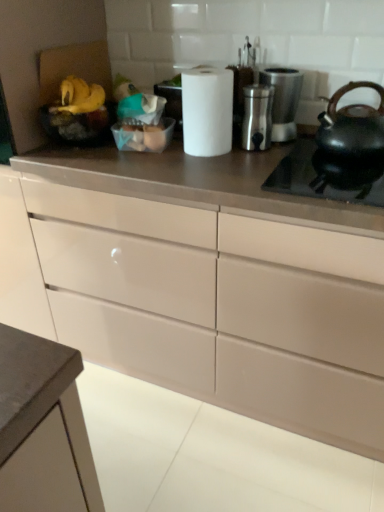
Question: Should I look upward or downward to see satin silver container at center, the 1th appliance from the left?

Choices:
 (A) up
 (B) down

Answer: (A)

Question: Does satin silver coffee maker at upper right, the 1th appliance from the right, have a smaller size compared to white matte paper towel at center?

Choices:
 (A) yes
 (B) no

Answer: (A)

Question: Does satin silver coffee maker at upper right, the 1th appliance from the right, have a larger size compared to white matte paper towel at center?

Choices:
 (A) yes
 (B) no

Answer: (B)

Question: Can white matte paper towel at center be found inside satin silver coffee maker at upper right, the 1th appliance from the right?

Choices:
 (A) yes
 (B) no

Answer: (B)

Question: Is satin silver coffee maker at upper right, which is counted as the 2th appliance, starting from the left, looking in the opposite direction of white matte paper towel at center?

Choices:
 (A) no
 (B) yes

Answer: (A)

Question: Can you confirm if satin silver coffee maker at upper right, which is counted as the 2th appliance, starting from the left, is shorter than white matte paper towel at center?

Choices:
 (A) yes
 (B) no

Answer: (A)

Question: From a real-world perspective, is satin silver coffee maker at upper right, which is counted as the 2th appliance, starting from the left, over white matte paper towel at center?

Choices:
 (A) yes
 (B) no

Answer: (B)

Question: Is the depth of yellow matte bananas at upper left, which is the 2th food from right to left, greater than that of matte black kettle at right?

Choices:
 (A) yes
 (B) no

Answer: (A)

Question: Does yellow matte bananas at upper left, which appears as the first food when viewed from the left, have a greater width compared to matte black kettle at right?

Choices:
 (A) yes
 (B) no

Answer: (B)

Question: Is the position of yellow matte bananas at upper left, which is the 2th food from right to left, less distant than that of matte black kettle at right?

Choices:
 (A) yes
 (B) no

Answer: (B)

Question: Can you confirm if yellow matte bananas at upper left, which is the 2th food from right to left, is taller than matte black kettle at right?

Choices:
 (A) no
 (B) yes

Answer: (A)

Question: Is yellow matte bananas at upper left, which is the 2th food from right to left, to the left of matte black kettle at right from the viewer's perspective?

Choices:
 (A) yes
 (B) no

Answer: (A)

Question: Can you confirm if yellow matte bananas at upper left, which is the 2th food from right to left, is shorter than matte black kettle at right?

Choices:
 (A) yes
 (B) no

Answer: (A)

Question: From a real-world perspective, is satin silver container at center, the 1th appliance from the left, physically below yellow matte bananas at upper left, which appears as the first food when viewed from the left?

Choices:
 (A) yes
 (B) no

Answer: (A)